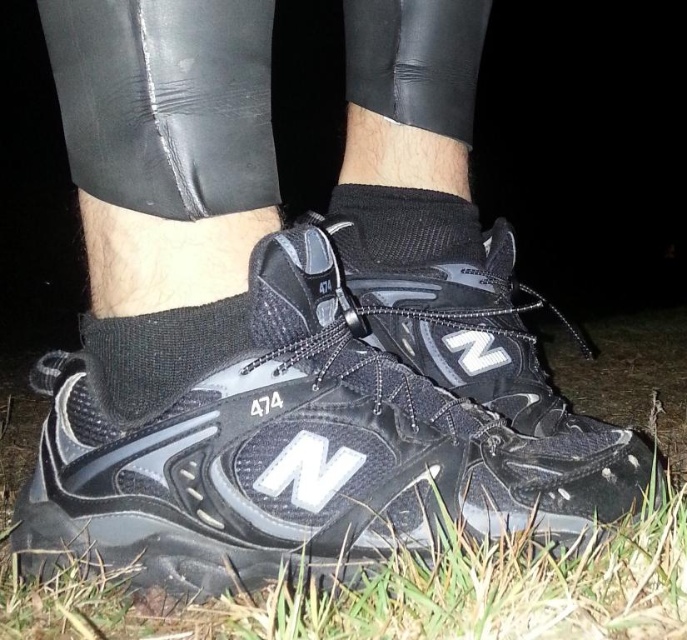
You are trying to determine which item is bigger between the black mesh shoe at center and the black mesh sock at center. Based on the scene described, which one is larger?

The black mesh shoe at center is larger than the black mesh sock at center.

Looking at this image, you are a photographer trying to capture the black New Balance sneakers at center. You want to focus on the white N logo on the side of the shoe. Where should you position your camera relative to the point marked at coordinates (x=326, y=435)?

The white N logo on the side of the black mesh shoe at center is located at the point marked at coordinates (x=326, y=435), so position your camera directly at that point to capture it.